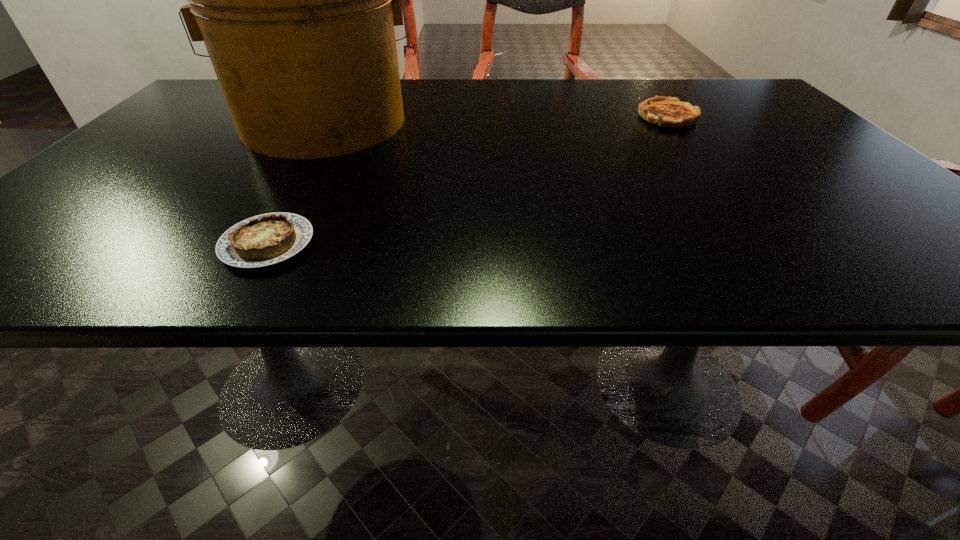
Image resolution: width=960 pixels, height=540 pixels. What are the coordinates of `free point between the right quiche and the tallest object` in the screenshot? It's located at (495, 119).

Image resolution: width=960 pixels, height=540 pixels. Find the location of `free space that is in between the right quiche and the bucket`. free space that is in between the right quiche and the bucket is located at coordinates (495, 119).

Locate an element on the screen. The image size is (960, 540). vacant area that lies between the right quiche and the tallest object is located at coordinates (495, 119).

This screenshot has height=540, width=960. Identify the location of blank region between the bucket and the taller quiche. (495, 119).

At what (x,y) coordinates should I click in order to perform the action: click on free space that is in between the shortest object and the rightmost object. Please return your answer as a coordinate pair (x, y). Looking at the image, I should click on (468, 180).

Find the location of a particular element. The height and width of the screenshot is (540, 960). free spot between the farther quiche and the shortest object is located at coordinates (468, 180).

Find the location of `blank region between the farther quiche and the left quiche`. blank region between the farther quiche and the left quiche is located at coordinates (468, 180).

I want to click on free space that is in between the right quiche and the left quiche, so click(x=468, y=180).

Choose which object is the second nearest neighbor to the right quiche. Please provide its 2D coordinates. Your answer should be formatted as a tuple, i.e. [(x, y)], where the tuple contains the x and y coordinates of a point satisfying the conditions above.

[(267, 239)]

Point out which object is positioned as the second nearest to the left quiche. Please provide its 2D coordinates. Your answer should be formatted as a tuple, i.e. [(x, y)], where the tuple contains the x and y coordinates of a point satisfying the conditions above.

[(662, 111)]